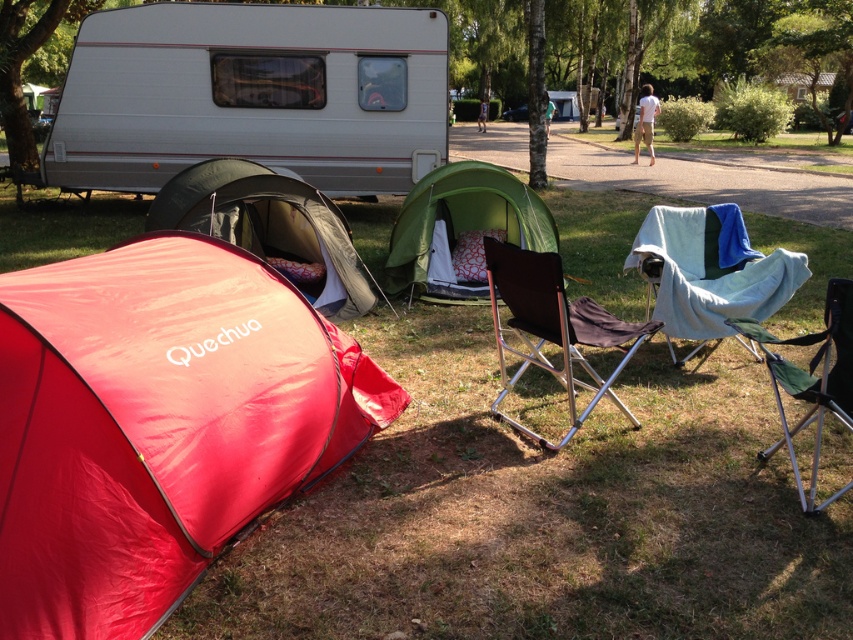
Question: Among these objects, which one is farthest from the camera?

Choices:
 (A) matte gray tent at center
 (B) red nylon tent at lower left
 (C) black metal folding chair at center
 (D) green grass at lower center

Answer: (A)

Question: Which object is positioned closest to the black metal folding chair at center?

Choices:
 (A) green fabric tent at center
 (B) blue fabric chair at center right

Answer: (B)

Question: Which point is closer to the camera taking this photo?

Choices:
 (A) (643, 266)
 (B) (538, 198)
 (C) (329, 289)
 (D) (489, 292)

Answer: (A)

Question: Does green fabric tent at center appear over skinny jeans at center?

Choices:
 (A) no
 (B) yes

Answer: (A)

Question: Does red nylon tent at lower left come behind blue fabric chair at center right?

Choices:
 (A) no
 (B) yes

Answer: (A)

Question: Does green grass at lower center appear on the left side of black metal folding chair at center?

Choices:
 (A) yes
 (B) no

Answer: (A)